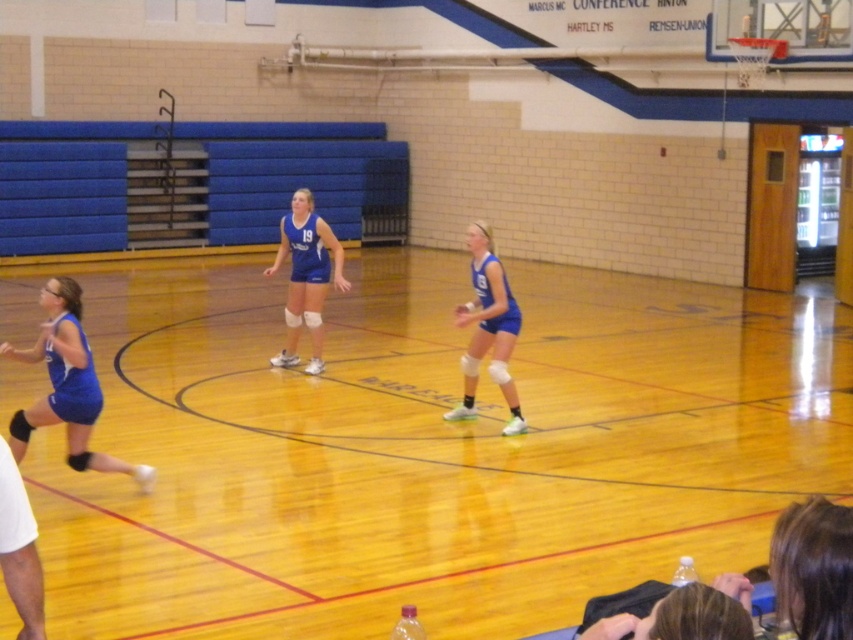
Question: Is matte blue shorts at left thinner than blue matte volleyball player at center?

Choices:
 (A) no
 (B) yes

Answer: (A)

Question: Which object appears closest to the camera in this image?

Choices:
 (A) matte blue shorts at left
 (B) blue matte volleyball uniform at center

Answer: (A)

Question: Which object is farther from the camera taking this photo?

Choices:
 (A) blue matte volleyball player at center
 (B) blue matte volleyball uniform at center

Answer: (B)

Question: Is matte blue shorts at left to the right of blue matte volleyball uniform at center from the viewer's perspective?

Choices:
 (A) yes
 (B) no

Answer: (B)

Question: From the image, what is the correct spatial relationship of matte blue shorts at left in relation to blue matte volleyball player at center?

Choices:
 (A) below
 (B) above

Answer: (A)

Question: Estimate the real-world distances between objects in this image. Which object is farther from the blue matte volleyball uniform at center?

Choices:
 (A) blue matte volleyball player at center
 (B) matte blue shorts at left

Answer: (B)